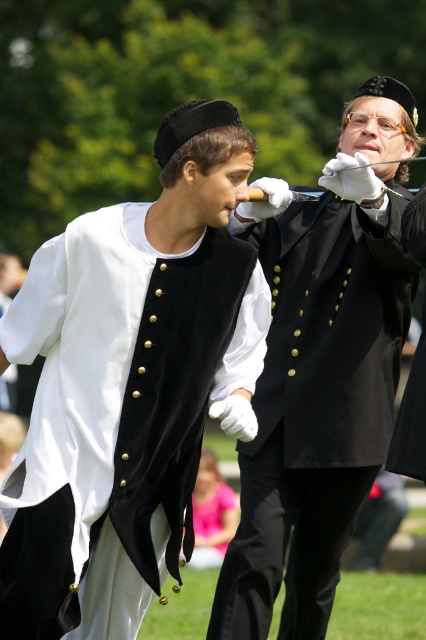
Question: Is velvet black vest at center closer to camera compared to black velvet vest at center?

Choices:
 (A) yes
 (B) no

Answer: (A)

Question: Which of the following is the farthest from the observer?

Choices:
 (A) black velvet vest at center
 (B) velvet black vest at center

Answer: (A)

Question: Which point is closer to the camera?

Choices:
 (A) (270, 484)
 (B) (114, 589)

Answer: (B)

Question: Is velvet black vest at center bigger than black velvet vest at center?

Choices:
 (A) no
 (B) yes

Answer: (A)

Question: Is velvet black vest at center thinner than black velvet vest at center?

Choices:
 (A) yes
 (B) no

Answer: (A)

Question: Which point is closer to the camera taking this photo?

Choices:
 (A) (235, 637)
 (B) (34, 474)

Answer: (B)